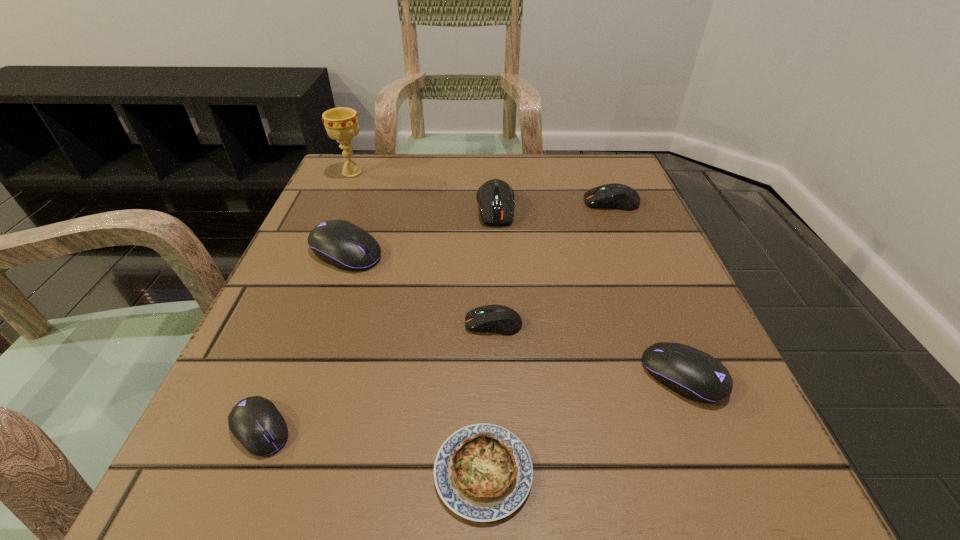
Find the location of a particular element. This screenshot has width=960, height=540. free space at the far edge of the desktop is located at coordinates 505,173.

The width and height of the screenshot is (960, 540). Find the location of `blank space at the near edge`. blank space at the near edge is located at coordinates (563, 448).

Locate an element on the screen. free space at the left edge is located at coordinates (297, 238).

Locate an element on the screen. The width and height of the screenshot is (960, 540). free space at the right edge of the desktop is located at coordinates (676, 326).

The height and width of the screenshot is (540, 960). Find the location of `vacant area at the far left corner`. vacant area at the far left corner is located at coordinates (333, 188).

The width and height of the screenshot is (960, 540). Identify the location of free region at the far right corner of the desktop. (626, 177).

In the image, there is a desktop. Where is `vacant space at the near right corner`? vacant space at the near right corner is located at coordinates (672, 522).

You are a GUI agent. You are given a task and a screenshot of the screen. Output one action in this format:
    pyautogui.click(x=<x>, y=<y>)
    Task: Click on the vacant region between the shortest object and the biggest dark computer equipment
    This screenshot has width=960, height=540.
    Given the screenshot: What is the action you would take?
    pyautogui.click(x=490, y=340)

This screenshot has width=960, height=540. Identify the location of free space between the shortest object and the biggest dark computer equipment. (490, 340).

Identify the location of free space between the second smallest black computer mouse and the biggest dark computer equipment. The width and height of the screenshot is (960, 540). (589, 292).